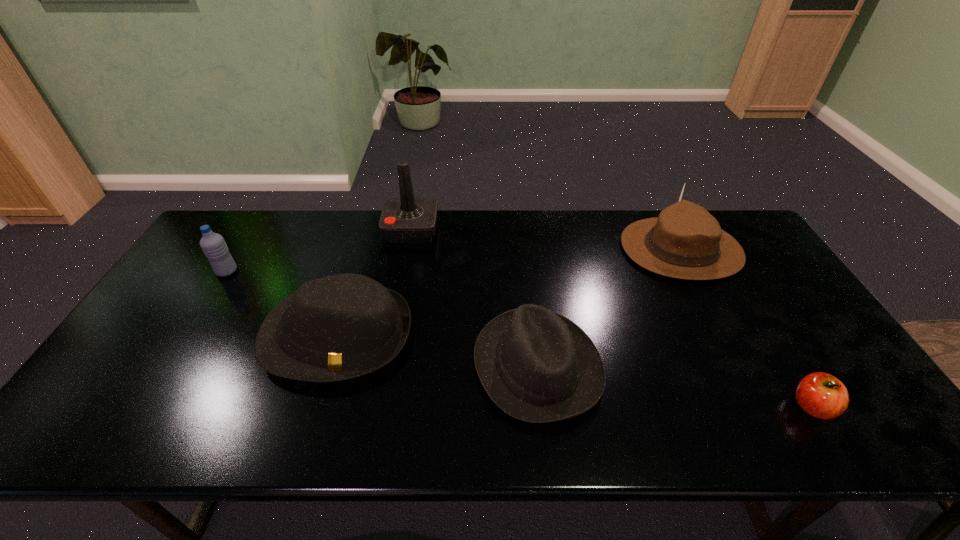
The width and height of the screenshot is (960, 540). Identify the location of object that stands as the fifth closest to the tallest object. (821, 395).

Identify which object is the fifth closest to the tallest object. Please provide its 2D coordinates. Your answer should be formatted as a tuple, i.e. [(x, y)], where the tuple contains the x and y coordinates of a point satisfying the conditions above.

[(821, 395)]

Locate which fedora ranks second in proximity to the leftmost fedora. Please provide its 2D coordinates. Your answer should be formatted as a tuple, i.e. [(x, y)], where the tuple contains the x and y coordinates of a point satisfying the conditions above.

[(686, 242)]

The width and height of the screenshot is (960, 540). I want to click on fedora that can be found as the second closest to the farthest fedora, so click(x=344, y=326).

This screenshot has height=540, width=960. In order to click on blank space that satisfies the following two spatial constraints: 1. on the front-facing side of the shortest object; 2. on the right side of the leftmost fedora in this screenshot , I will do `click(317, 406)`.

Identify the location of vacant space that satisfies the following two spatial constraints: 1. on the back side of the joystick; 2. on the right side of the water bottle. The width and height of the screenshot is (960, 540). (253, 230).

Find the location of a particular element. Image resolution: width=960 pixels, height=540 pixels. vacant position in the image that satisfies the following two spatial constraints: 1. on the front side of the shortest fedora; 2. on the left side of the apple is located at coordinates coord(542,406).

Identify the location of vacant region that satisfies the following two spatial constraints: 1. on the feather side of the rightmost fedora; 2. on the front side of the second shortest object. pos(741,366).

Where is `vacant position in the image that satisfies the following two spatial constraints: 1. on the front-facing side of the leftmost fedora; 2. on the right side of the apple`? Image resolution: width=960 pixels, height=540 pixels. vacant position in the image that satisfies the following two spatial constraints: 1. on the front-facing side of the leftmost fedora; 2. on the right side of the apple is located at coordinates (317, 406).